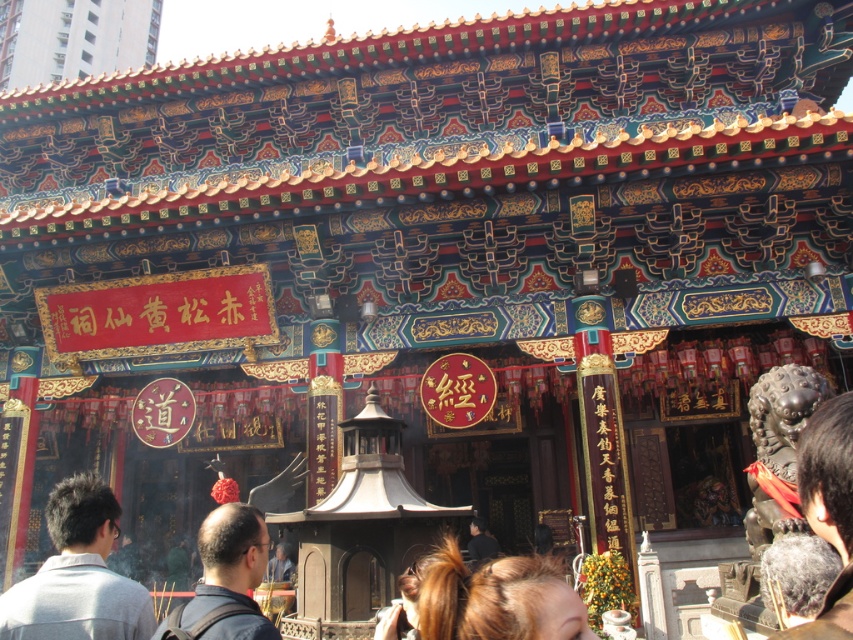
Between gray fabric shirt at lower left and dark blue fabric at center, which one appears on the right side from the viewer's perspective?

dark blue fabric at center

Can you confirm if gray fabric shirt at lower left is smaller than dark blue fabric at center?

Yes.

Which is in front, point (16, 600) or point (231, 579)?

Positioned in front is point (231, 579).

Locate an element on the screen. This screenshot has height=640, width=853. gray fabric shirt at lower left is located at coordinates (78, 573).

Is gray fabric shirt at lower left smaller than black stone lion at lower right?

No.

Does gray fabric shirt at lower left appear on the right side of black stone lion at lower right?

Incorrect, gray fabric shirt at lower left is not on the right side of black stone lion at lower right.

Who is more distant from viewer, [39,628] or [816,531]?

The point [39,628] is behind.

Locate an element on the screen. The height and width of the screenshot is (640, 853). gray fabric shirt at lower left is located at coordinates (78, 573).

Based on the photo, who is positioned more to the left, black stone lion at lower right or dark blue fabric at center?

dark blue fabric at center is more to the left.

Which is below, black stone lion at lower right or dark blue fabric at center?

Positioned lower is dark blue fabric at center.

Identify the location of black stone lion at lower right. (828, 509).

Where is `black stone lion at lower right`? The width and height of the screenshot is (853, 640). black stone lion at lower right is located at coordinates (828, 509).